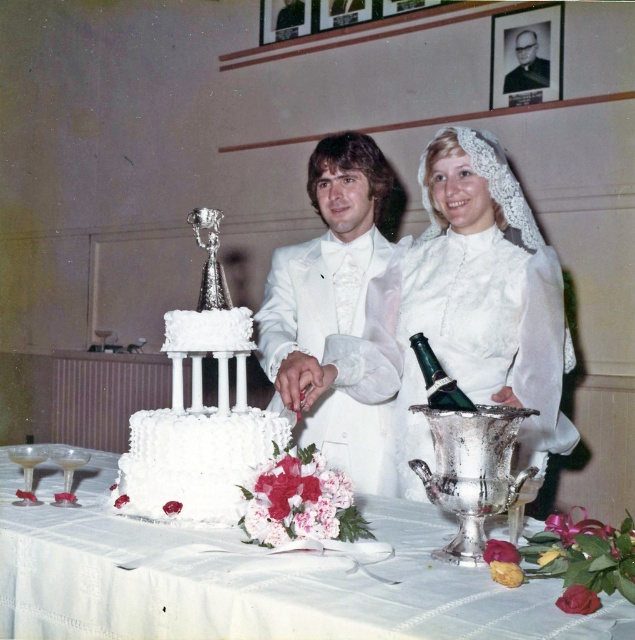
Question: Can you confirm if white satin dress at center is smaller than white frosted cake at center?

Choices:
 (A) yes
 (B) no

Answer: (B)

Question: Can you confirm if white satin dress at center is wider than green glass bottle at center?

Choices:
 (A) yes
 (B) no

Answer: (A)

Question: Estimate the real-world distances between objects in this image. Which object is closer to the white frosted cake at center?

Choices:
 (A) white satin tuxedo at center
 (B) white fabric tablecloth at center
 (C) black glossy portrait at upper center
 (D) white textured cake at center

Answer: (D)

Question: Is white satin tuxedo at center bigger than white frosted cake at center?

Choices:
 (A) yes
 (B) no

Answer: (A)

Question: Which point is closer to the camera taking this photo?

Choices:
 (A) (231, 454)
 (B) (511, 68)
 (C) (352, 460)

Answer: (A)

Question: Which of the following is the farthest from the observer?

Choices:
 (A) (411, 452)
 (B) (140, 417)
 (C) (323, 147)

Answer: (C)